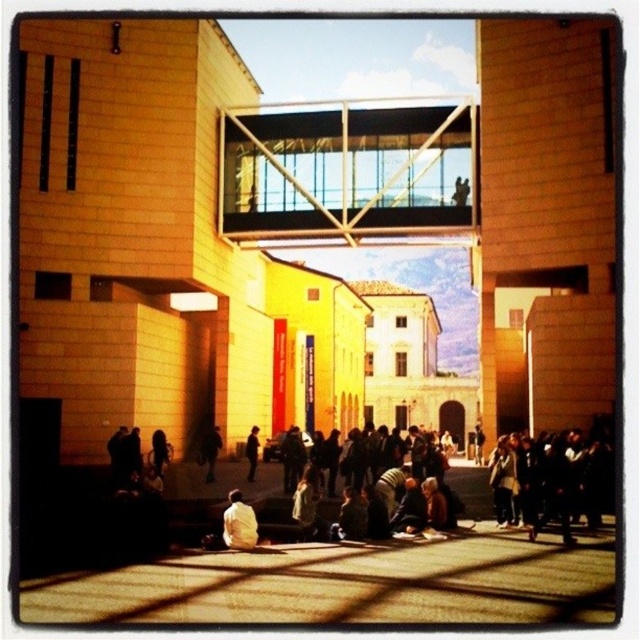
You are standing at the entrance of the glass walkway between the two buildings and notice a light beige fabric at lower center. Based on its coordinates, is it closer to the left or right side of the scene?

The light beige fabric at lower center is located at point 0.819 on the x axis, which is closer to the right side of the scene.

You are a photographer standing at the camera position. You want to capture a closeup shot of the white fabric bag at center. Given that your longest zoom lens can reach up to 200 feet, will you be able to get a clear closeup without moving closer?

The white fabric bag at center is 199.89 feet away from camera. Since your longest zoom lens can reach up to 200 feet, you can get a clear closeup without moving closer.